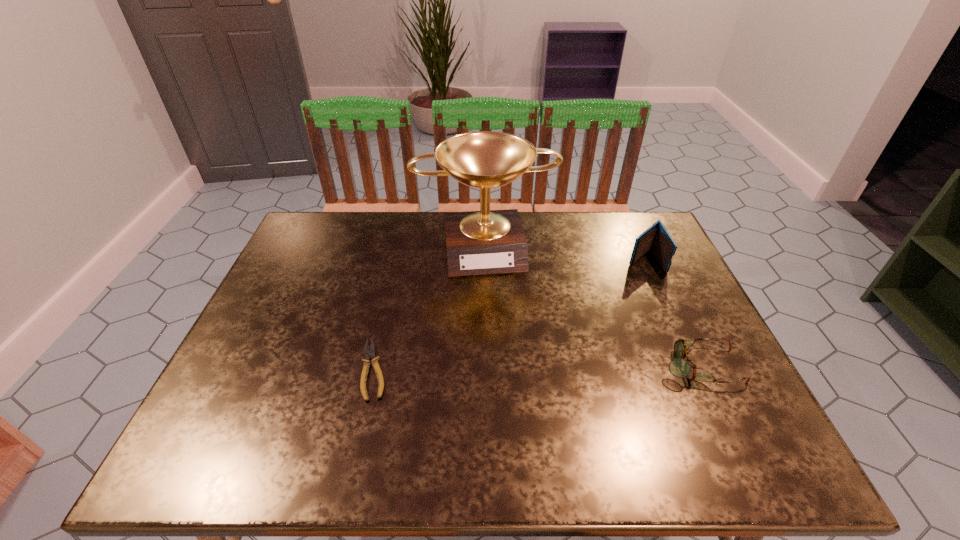
At what (x,y) coordinates should I click in order to perform the action: click on vacant area that lies between the shortest object and the wallet. Please return your answer as a coordinate pair (x, y). Looking at the image, I should click on (509, 315).

Identify the location of free spot between the third shortest object and the leftmost object. (509, 315).

What are the coordinates of `vacant point located between the shortest object and the spectacles` in the screenshot? It's located at (x=537, y=368).

Identify the location of empty location between the shortest object and the award. (429, 308).

The height and width of the screenshot is (540, 960). Identify the location of free space between the leftmost object and the spectacles. (537, 368).

Image resolution: width=960 pixels, height=540 pixels. I want to click on free point between the leftmost object and the spectacles, so click(537, 368).

Identify the location of vacant point located between the pliers and the spectacles. This screenshot has width=960, height=540. (537, 368).

Where is `object that is the third closest to the second shortest object`? Image resolution: width=960 pixels, height=540 pixels. object that is the third closest to the second shortest object is located at coordinates (370, 353).

Locate an element on the screen. object that can be found as the second closest to the spectacles is located at coordinates (488, 241).

Find the location of a particular element. The image size is (960, 540). free location that satisfies the following two spatial constraints: 1. on the front side of the third tallest object; 2. on the front-facing side of the award is located at coordinates (x=487, y=366).